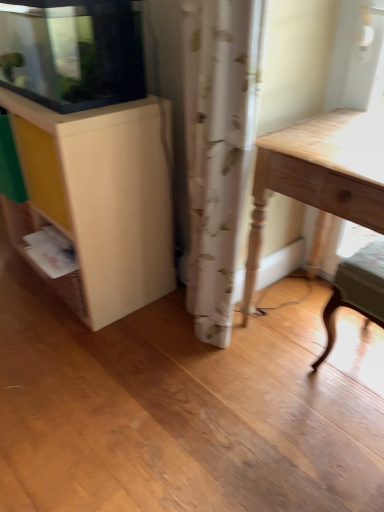
At what (x,y) coordinates should I click in order to perform the action: click on free space to the left of wooden chair at lower right. Please return your answer as a coordinate pair (x, y). The image size is (384, 512). Looking at the image, I should click on (290, 371).